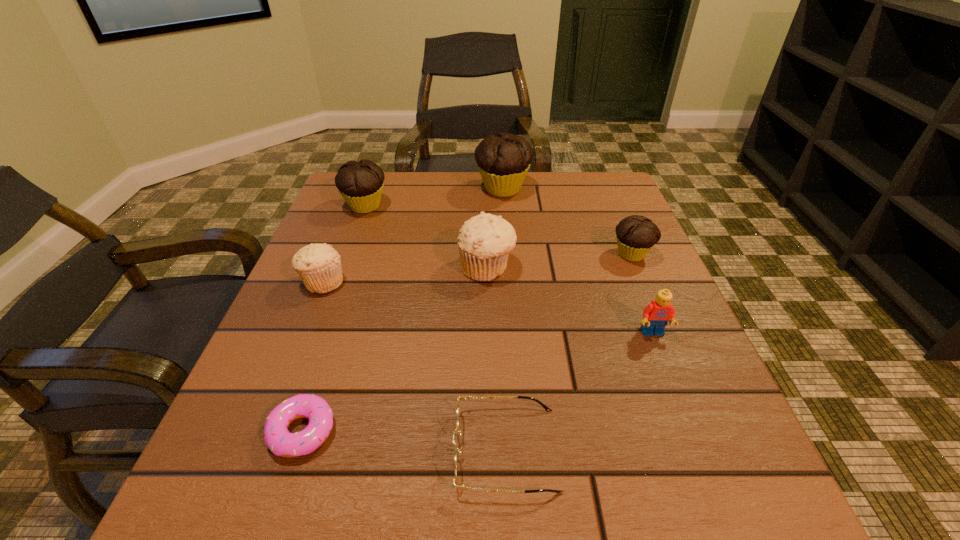
Identify the location of doughnut. This screenshot has width=960, height=540. (278, 439).

Identify the location of pink doughnut. (278, 439).

Find the location of a particular element. vacant area located 0.240m on the left of the tallest object is located at coordinates (384, 188).

Identify the location of free location located on the left of the bigger beige muffin. This screenshot has height=540, width=960. (386, 267).

Where is `free spot located on the right of the leftmost chocolate muffin`? This screenshot has height=540, width=960. free spot located on the right of the leftmost chocolate muffin is located at coordinates (533, 206).

Identify the location of vacant point located 0.270m on the face of the Lego. This screenshot has width=960, height=540. (718, 500).

The image size is (960, 540). Identify the location of free region located 0.140m on the back of the smaller beige muffin. (345, 229).

This screenshot has width=960, height=540. In order to click on vacant space located 0.050m on the front of the rightmost chocolate muffin in this screenshot , I will do `click(644, 283)`.

The image size is (960, 540). I want to click on vacant space located on the lenses of the spectacles, so click(x=283, y=449).

At what (x,y) coordinates should I click in order to perform the action: click on vacant space located on the lenses of the spectacles. Please return your answer as a coordinate pair (x, y). The width and height of the screenshot is (960, 540). Looking at the image, I should click on (333, 449).